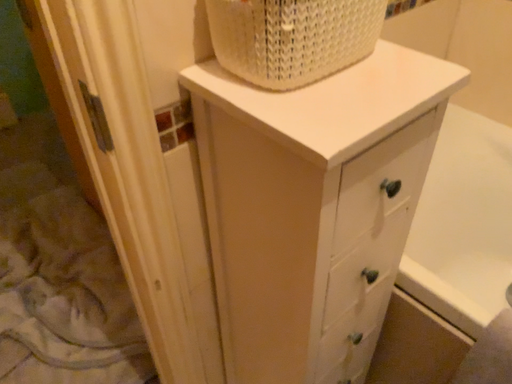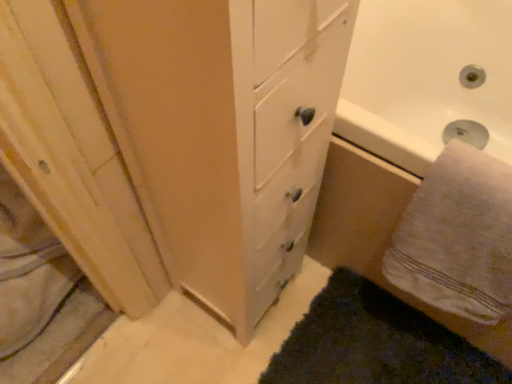
Question: How did the camera likely rotate when shooting the video?

Choices:
 (A) rotated downward
 (B) rotated upward

Answer: (A)